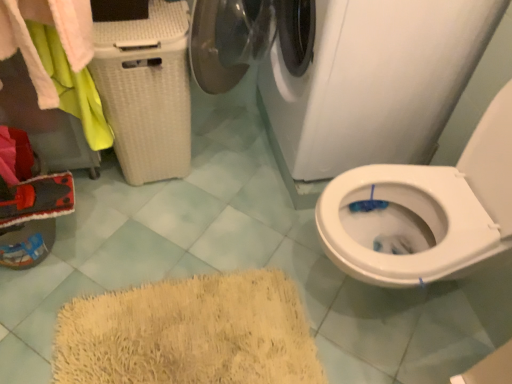
Measure the distance between white wicker laundry basket at left and camera.

They are 34.09 inches apart.

This screenshot has width=512, height=384. What do you see at coordinates (58, 59) in the screenshot?
I see `white wicker laundry basket at left` at bounding box center [58, 59].

This screenshot has width=512, height=384. What do you see at coordinates (375, 82) in the screenshot? I see `white glossy washing machine at upper center` at bounding box center [375, 82].

Image resolution: width=512 pixels, height=384 pixels. Identify the location of white wicker laundry basket at left. (58, 59).

Considering the positions of objects white glossy washing machine at upper center and white wicker laundry basket at left in the image provided, who is in front, white glossy washing machine at upper center or white wicker laundry basket at left?

white glossy washing machine at upper center is more forward.

Is the surface of white glossy washing machine at upper center in direct contact with white wicker laundry basket at left?

No, white glossy washing machine at upper center is not touching white wicker laundry basket at left.

Considering the relative positions of white glossy washing machine at upper center and white wicker laundry basket at left in the image provided, is white glossy washing machine at upper center to the left of white wicker laundry basket at left from the viewer's perspective?

No, white glossy washing machine at upper center is not to the left of white wicker laundry basket at left.

Does white glossy washing machine at upper center turn towards white wicker laundry basket at left?

Yes.

Locate an element on the screen. This screenshot has height=384, width=512. laundry below the white wicker laundry basket at left (from the image's perspective) is located at coordinates (58, 59).

Is white wicker laundry basket at left not near white wicker laundry basket at left?

white wicker laundry basket at left is near white wicker laundry basket at left, not far away.

Is white wicker laundry basket at left taller or shorter than white wicker laundry basket at left?

Clearly, white wicker laundry basket at left is taller compared to white wicker laundry basket at left.

Which of these two, white wicker laundry basket at left or white wicker laundry basket at left, is thinner?

white wicker laundry basket at left.

From the image's perspective, between white glossy washing machine at upper center and white wicker laundry basket at left, who is located below?

white wicker laundry basket at left appears lower in the image.

Can you confirm if white glossy washing machine at upper center is thinner than white wicker laundry basket at left?

No.

Which object is positioned more to the left, white glossy washing machine at upper center or white wicker laundry basket at left?

Positioned to the left is white wicker laundry basket at left.

Does white glossy washing machine at upper center have a larger size compared to white wicker laundry basket at left?

Yes, white glossy washing machine at upper center is bigger than white wicker laundry basket at left.

Is white wicker laundry basket at left not near white glossy washing machine at upper center?

That's not correct — white wicker laundry basket at left is a little close to white glossy washing machine at upper center.

Find the location of a particular element. This screenshot has width=512, height=384. washing machine on the right of white wicker laundry basket at left is located at coordinates (375, 82).

Is white wicker laundry basket at left inside the boundaries of white glossy washing machine at upper center, or outside?

white wicker laundry basket at left cannot be found inside white glossy washing machine at upper center.

In the image, is white wicker laundry basket at left positioned in front of or behind white glossy washing machine at upper center?

white wicker laundry basket at left is behind white glossy washing machine at upper center.

This screenshot has height=384, width=512. In order to click on laundry that appears on the left of white glossy washing machine at upper center in this screenshot , I will do `click(58, 59)`.

Do you think white wicker laundry basket at left is within white glossy washing machine at upper center, or outside of it?

white wicker laundry basket at left exists outside the volume of white glossy washing machine at upper center.

Between point (60, 23) and point (283, 60), which one is positioned behind?

The point (283, 60) is farther.

Is white wicker laundry basket at left in front of or behind white glossy washing machine at upper center in the image?

Clearly, white wicker laundry basket at left is behind white glossy washing machine at upper center.

Is point (73, 3) closer or farther from the camera than point (141, 179)?

Point (73, 3).

Is white wicker laundry basket at left facing away from white wicker laundry basket at left?

No.

From the picture: Would you consider white wicker laundry basket at left to be distant from white wicker laundry basket at left?

No, white wicker laundry basket at left is in close proximity to white wicker laundry basket at left.

Locate an element on the screen. The width and height of the screenshot is (512, 384). laundry on the left of the white glossy washing machine at upper center is located at coordinates (58, 59).

Find the location of a particular element. The height and width of the screenshot is (384, 512). laundry that appears in front of the white wicker laundry basket at left is located at coordinates (58, 59).

Estimate the real-world distances between objects in this image. Which object is further from white wicker laundry basket at left, white wicker laundry basket at left or white glossy washing machine at upper center?

white glossy washing machine at upper center lies further to white wicker laundry basket at left than the other object.

Considering their positions, is white glossy washing machine at upper center positioned further to white wicker laundry basket at left than white wicker laundry basket at left?

Among the two, white glossy washing machine at upper center is located further to white wicker laundry basket at left.

Estimate the real-world distances between objects in this image. Which object is closer to white glossy washing machine at upper center, white wicker laundry basket at left or white wicker laundry basket at left?

white wicker laundry basket at left is closer to white glossy washing machine at upper center.

Which object lies nearer to the anchor point white wicker laundry basket at left, white wicker laundry basket at left or white glossy washing machine at upper center?

white wicker laundry basket at left lies closer to white wicker laundry basket at left than the other object.

Estimate the real-world distances between objects in this image. Which object is further from white glossy washing machine at upper center, white wicker laundry basket at left or white wicker laundry basket at left?

white wicker laundry basket at left lies further to white glossy washing machine at upper center than the other object.

Based on their spatial positions, is white glossy washing machine at upper center or white wicker laundry basket at left closer to white wicker laundry basket at left?

white wicker laundry basket at left is positioned closer to the anchor white wicker laundry basket at left.

Find the location of `laundry basket between white wicker laundry basket at left and white glossy washing machine at upper center from left to right`. laundry basket between white wicker laundry basket at left and white glossy washing machine at upper center from left to right is located at coordinates (146, 91).